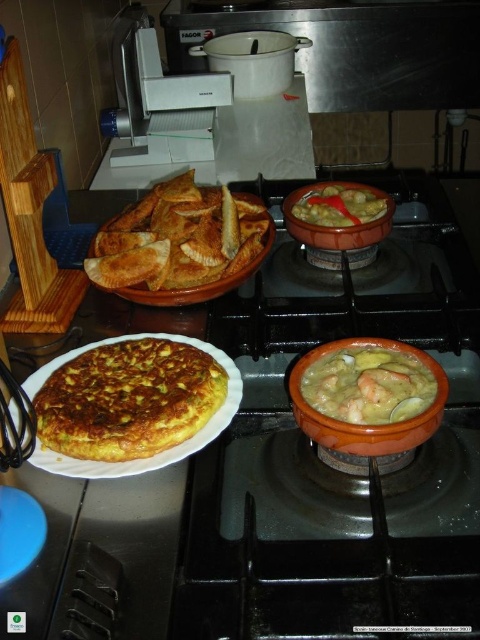
Is black matte gas stove at center below yellow omelette at center?

No.

Is point (313, 465) behind point (132, 424)?

Yes, it is behind point (132, 424).

The height and width of the screenshot is (640, 480). I want to click on black matte gas stove at center, so click(x=285, y=488).

Between point (146, 228) and point (395, 419), which one is positioned in front?

Point (395, 419) is in front.

Which is behind, point (156, 221) or point (304, 371)?

Point (156, 221)

Which is in front, point (184, 204) or point (348, 387)?

Point (348, 387) is more forward.

The image size is (480, 640). I want to click on golden brown crispy pastry at center, so click(x=179, y=237).

Can you confirm if black matte gas stove at center is bigger than matte clay bowl at upper center?

Correct, black matte gas stove at center is larger in size than matte clay bowl at upper center.

Who is higher up, black matte gas stove at center or matte clay bowl at upper center?

Positioned higher is matte clay bowl at upper center.

Describe the element at coordinates (285, 488) in the screenshot. This screenshot has height=640, width=480. I see `black matte gas stove at center` at that location.

The height and width of the screenshot is (640, 480). Find the location of `black matte gas stove at center`. black matte gas stove at center is located at coordinates (285, 488).